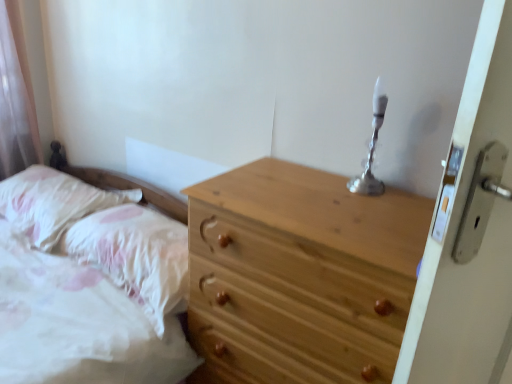
At what (x,y) coordinates should I click in order to perform the action: click on free space in front of silver metallic candle holder at upper right. Please return your answer as a coordinate pair (x, y). Looking at the image, I should click on (370, 207).